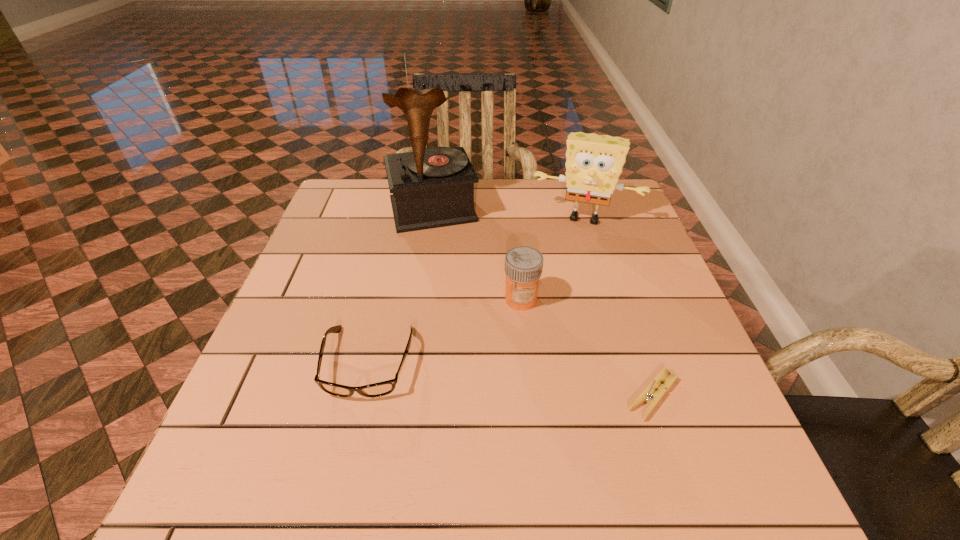
Locate an element on the screen. This screenshot has height=540, width=960. vacant area situated 0.210m on the label side of the third tallest object is located at coordinates (464, 380).

Identify the location of vacant area situated 0.390m on the face of the sponge. The image size is (960, 540). (547, 334).

Where is `vacant space located on the face of the sponge`? The image size is (960, 540). vacant space located on the face of the sponge is located at coordinates (554, 308).

In order to click on vacant space situated 0.400m on the face of the sponge in this screenshot , I will do `click(546, 338)`.

At what (x,y) coordinates should I click in order to perform the action: click on free space located at the horn opening of the tallest object. Please return your answer as a coordinate pair (x, y). The image size is (960, 540). Looking at the image, I should click on (470, 328).

Identify the location of vacant space located at the horn opening of the tallest object. (460, 293).

The image size is (960, 540). Identify the location of vacant area situated at the horn opening of the tallest object. (472, 335).

Where is `sponge positioned at the far edge`? sponge positioned at the far edge is located at coordinates (594, 163).

The width and height of the screenshot is (960, 540). I want to click on phonograph_record situated at the far edge, so pyautogui.click(x=433, y=187).

Find the location of a particular element. This screenshot has height=540, width=960. spectacles located at the near edge is located at coordinates (379, 389).